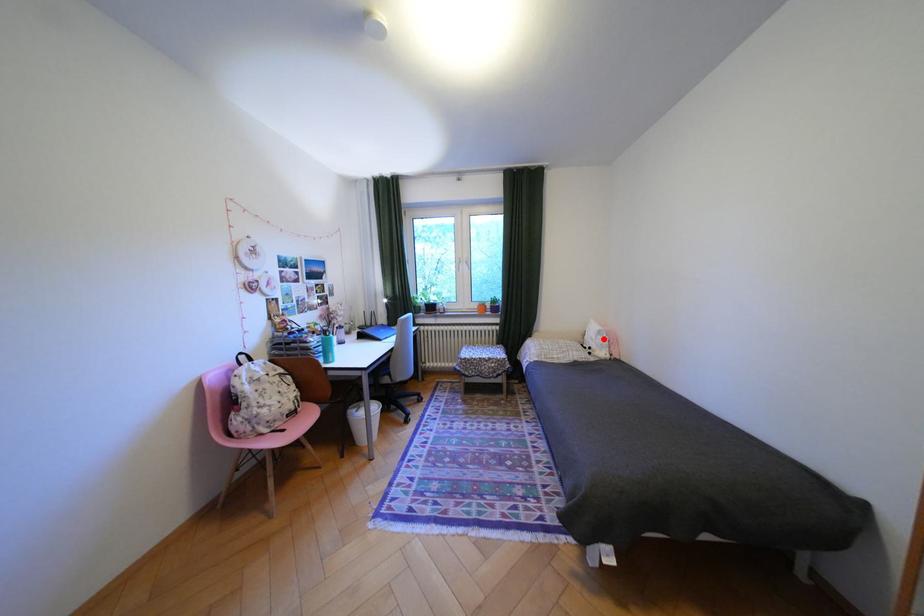
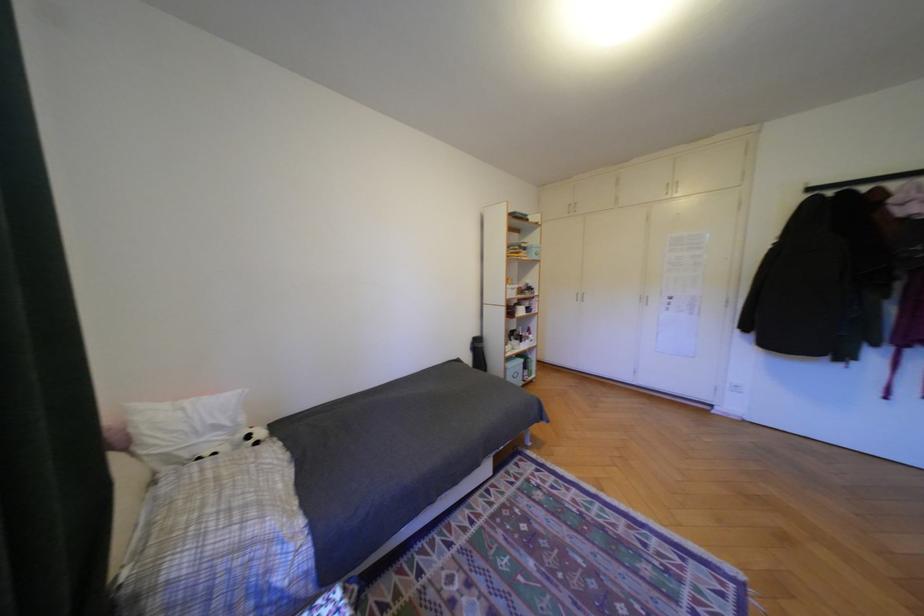
Find the pixel in the second image that matches the highlighted location in the first image.

(228, 427)